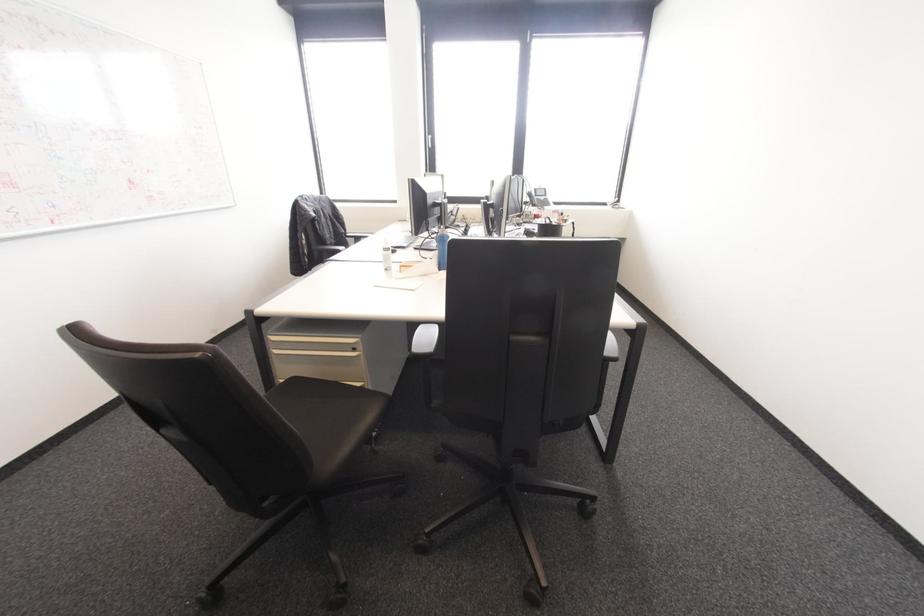
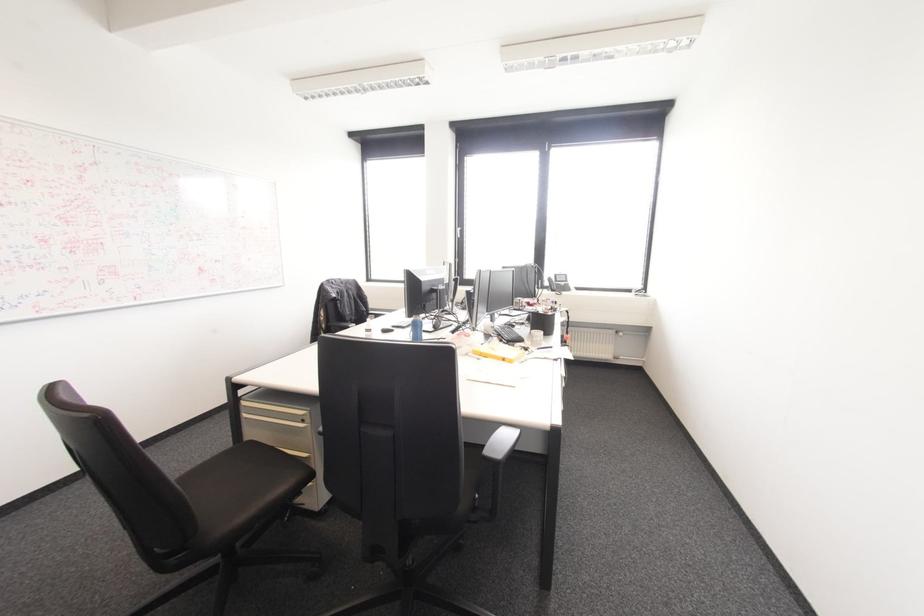
In the second image, find the point that corresponds to the point at 369,416 in the first image.

(281, 488)